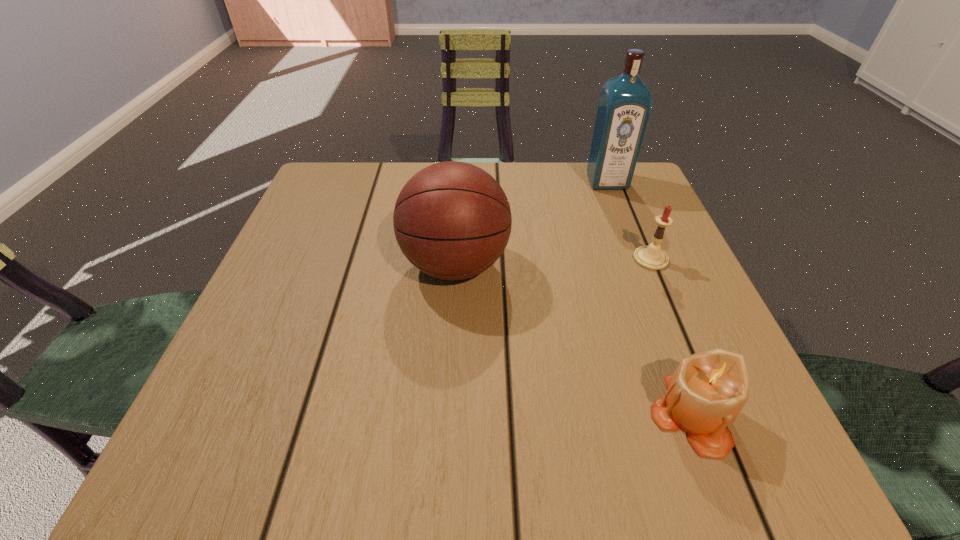
Identify the location of object that is at the far edge. (625, 102).

Where is `object situated at the near edge`? The width and height of the screenshot is (960, 540). object situated at the near edge is located at coordinates (708, 390).

Find the location of a particular element. This screenshot has width=960, height=540. liquor that is at the right edge is located at coordinates (x=625, y=102).

Where is `object situated at the far right corner`? This screenshot has width=960, height=540. object situated at the far right corner is located at coordinates (625, 102).

This screenshot has height=540, width=960. What are the coordinates of `object present at the near right corner` in the screenshot? It's located at (708, 390).

I want to click on free space at the far edge of the desktop, so click(525, 171).

Image resolution: width=960 pixels, height=540 pixels. Find the location of `blank area at the near edge`. blank area at the near edge is located at coordinates (x=476, y=412).

In the image, there is a desktop. Where is `free region at the left edge`? free region at the left edge is located at coordinates 234,354.

You are a GUI agent. You are given a task and a screenshot of the screen. Output one action in this format:
    pyautogui.click(x=<x>, y=<y>)
    Task: Click on the free region at the right edge of the desktop
    The height and width of the screenshot is (540, 960).
    Given the screenshot: What is the action you would take?
    pyautogui.click(x=708, y=301)

In the image, there is a desktop. At what (x,y) coordinates should I click in order to perform the action: click on free space at the far left corner. Please return your answer as a coordinate pair (x, y). Looking at the image, I should click on (331, 176).